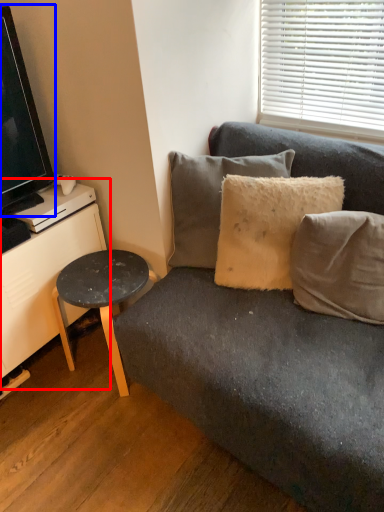
Question: Which point is closer to the camera, dresser (highlighted by a red box) or television (highlighted by a blue box)?

Choices:
 (A) dresser
 (B) television

Answer: (B)